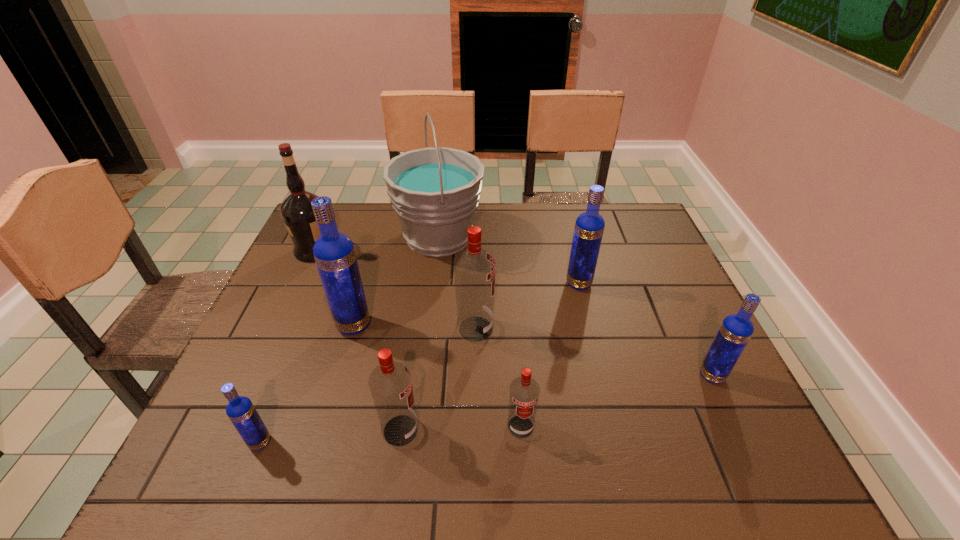
Find the location of `free spot between the second smallest red vodka and the second nearest blue vodka`. free spot between the second smallest red vodka and the second nearest blue vodka is located at coordinates (556, 403).

Identify the location of free spot between the leftmost vodka and the liquor. The width and height of the screenshot is (960, 540). (288, 346).

Where is `free space between the second smallest blue vodka and the liquor`? This screenshot has width=960, height=540. free space between the second smallest blue vodka and the liquor is located at coordinates (514, 313).

You are a GUI agent. You are given a task and a screenshot of the screen. Output one action in this format:
    pyautogui.click(x=<x>, y=<y>)
    Task: Click on the vacant space that's between the farthest blue vodka and the second smallest red vodka
    Image resolution: width=960 pixels, height=540 pixels.
    Given the screenshot: What is the action you would take?
    pyautogui.click(x=490, y=357)

At what (x,y) coordinates should I click in order to perform the action: click on free spot between the biggest red vodka and the second biggest blue vodka. Please return your answer as a coordinate pair (x, y). Looking at the image, I should click on (527, 306).

Locate which object ranks third in proximity to the liquor. Please provide its 2D coordinates. Your answer should be formatted as a tuple, i.e. [(x, y)], where the tuple contains the x and y coordinates of a point satisfying the conditions above.

[(474, 268)]

Locate an element on the screen. The width and height of the screenshot is (960, 540). object that is the sixth nearest to the third blue vodka from left to right is located at coordinates (334, 253).

Locate which vodka is the second closest to the nearest blue vodka. Please provide its 2D coordinates. Your answer should be formatted as a tuple, i.e. [(x, y)], where the tuple contains the x and y coordinates of a point satisfying the conditions above.

[(334, 253)]

Identify which vodka is the nearest to the leftmost red vodka. Please provide its 2D coordinates. Your answer should be formatted as a tuple, i.e. [(x, y)], where the tuple contains the x and y coordinates of a point satisfying the conditions above.

[(524, 391)]

Locate an element on the screen. The width and height of the screenshot is (960, 540). the closest blue vodka to the liquor is located at coordinates (334, 253).